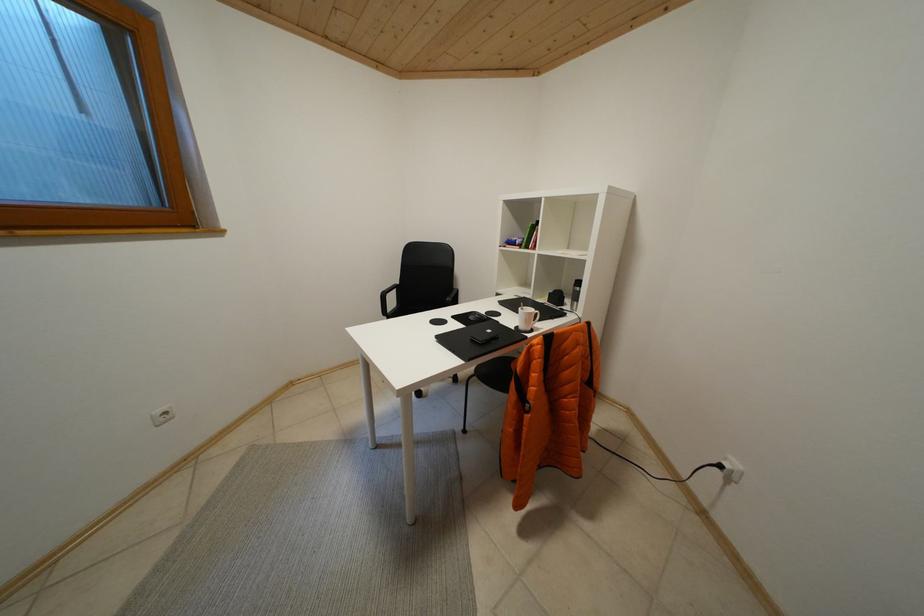
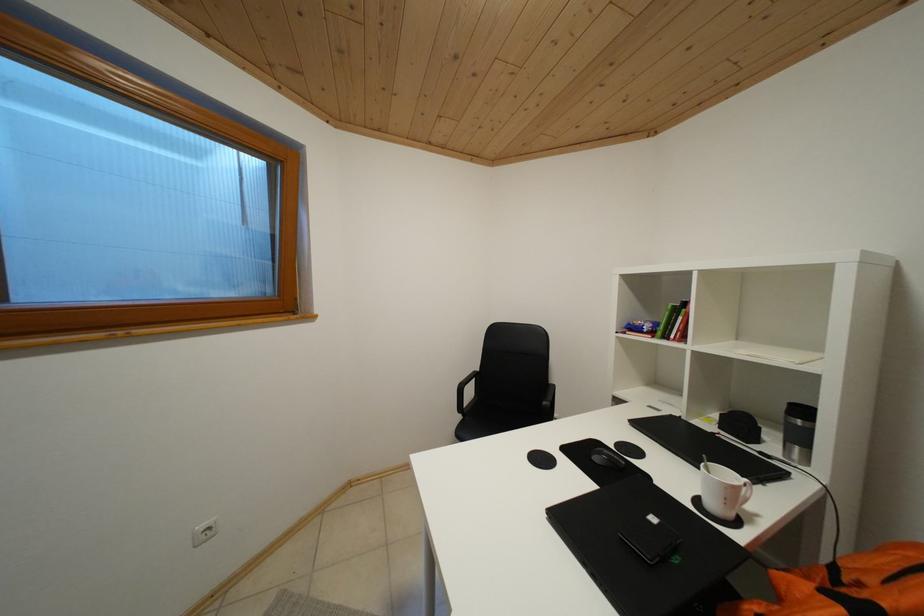
Question: The camera is either moving clockwise (left) or counter-clockwise (right) around the object. The first image is from the beginning of the video and the second image is from the end. Is the camera moving left or right when shooting the video?

Choices:
 (A) Left
 (B) Right

Answer: (B)